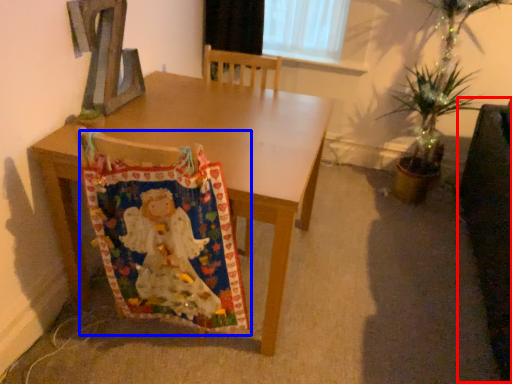
Question: Among these objects, which one is farthest to the camera, swivel chair (highlighted by a red box) or blanket (highlighted by a blue box)?

Choices:
 (A) swivel chair
 (B) blanket

Answer: (B)